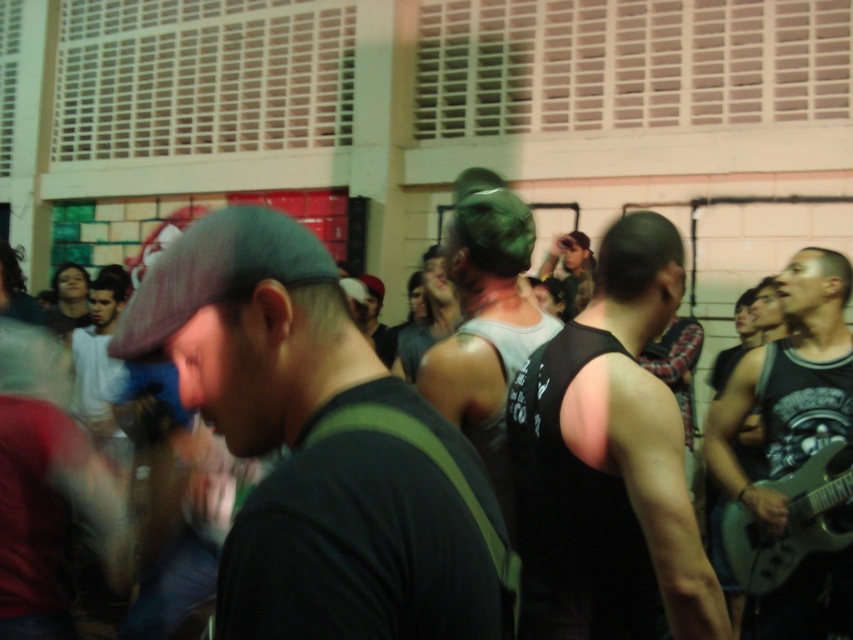
You are at a social event and see two items at the center of the scene. The gray matte tank top at center and the matte green cap at center. Which one is located to the left?

The gray matte tank top at center is positioned on the left side of the matte green cap at center.